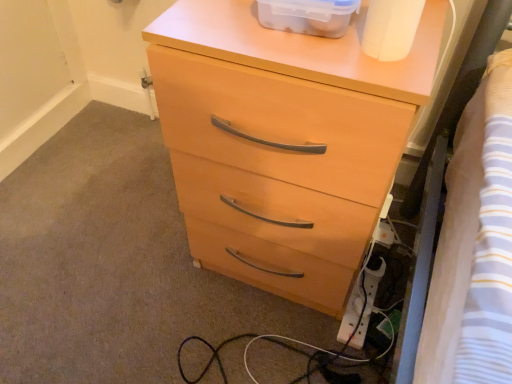
At what (x,y) coordinates should I click in order to perform the action: click on free space in front of white matte toilet paper at upper right. Please return your answer as a coordinate pair (x, y). Image resolution: width=512 pixels, height=384 pixels. Looking at the image, I should click on (390, 81).